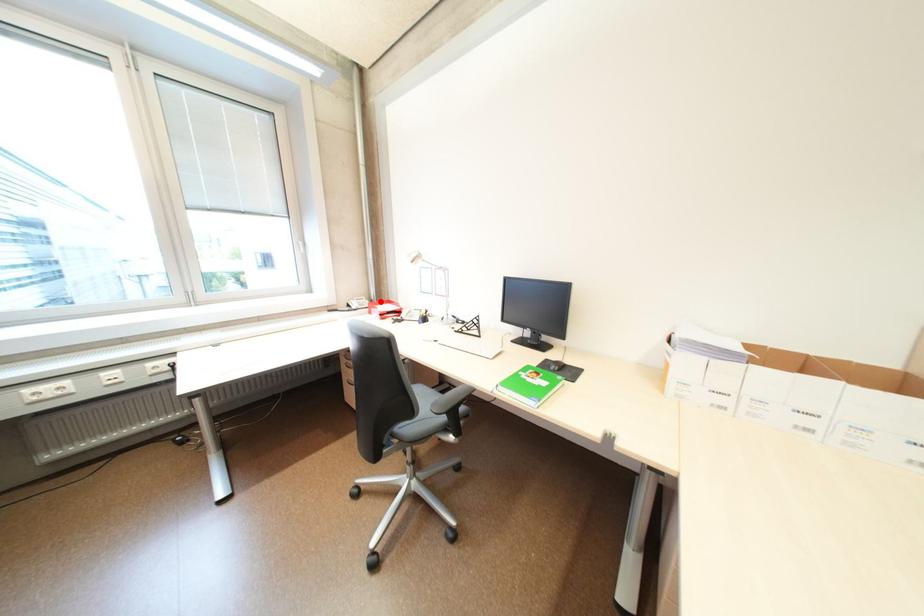
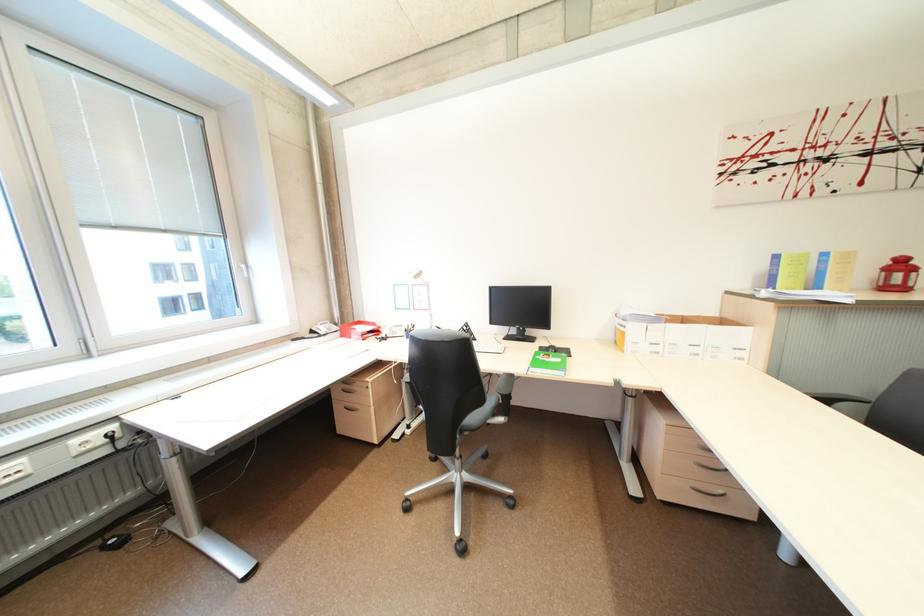
Locate, in the second image, the point that corresponds to the highlighted location in the first image.

(345, 325)